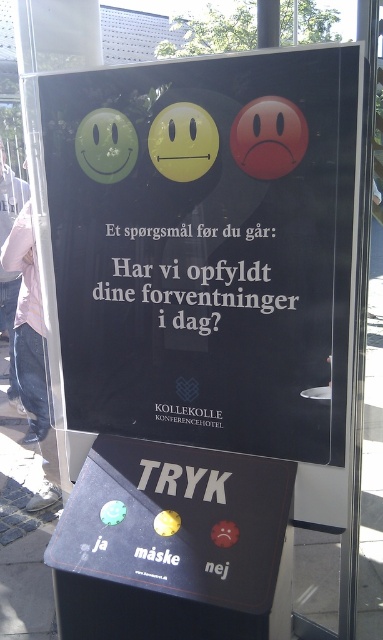
Question: Is black glossy poster at center in front of rubberized plastic buttons at center?

Choices:
 (A) yes
 (B) no

Answer: (A)

Question: Does black glossy poster at center have a smaller size compared to rubberized plastic buttons at center?

Choices:
 (A) no
 (B) yes

Answer: (A)

Question: Which of the following is the closest to the observer?

Choices:
 (A) [x=103, y=397]
 (B) [x=216, y=493]

Answer: (B)

Question: Is black glossy poster at center behind rubberized plastic buttons at center?

Choices:
 (A) no
 (B) yes

Answer: (A)